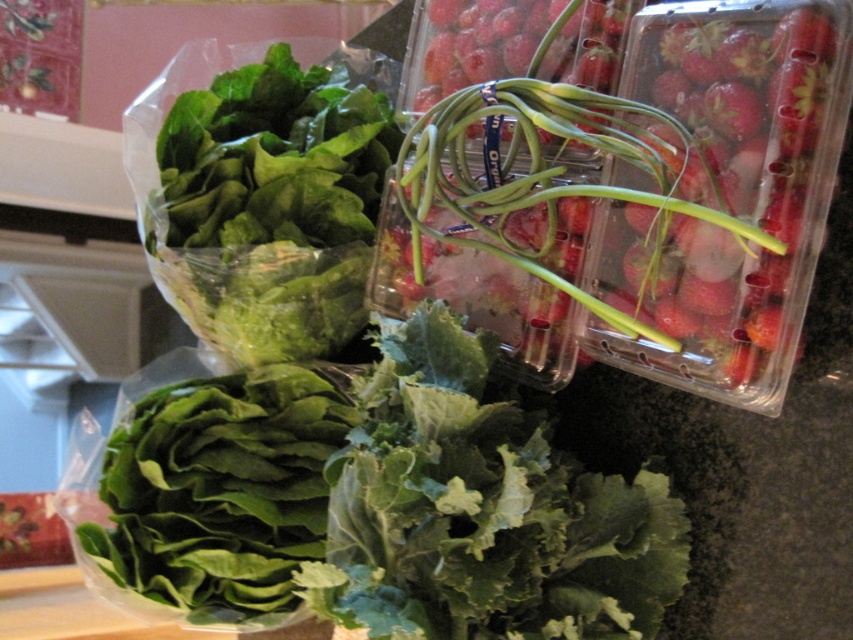
You are standing in front of the produce display. There are two points marked on the image. The first point is at coordinates point (451, 465) and the second is at point (294, 296). Which point is closer to you?

Point (451, 465) is closer to the viewer than point (294, 296).

You are organizing the produce section at a grocery store. You have two green leafy items on the counter. The green leafy at center and the green leafy lettuce at lower left. Which one should you place in the larger storage container?

The green leafy at center should be placed in the larger storage container because it has a larger size compared to the green leafy lettuce at lower left.

You are standing in front of the dark countertop with fresh produce. There is a green leafy at center at point (482, 512). Where is the green leafy at center located relative to the strawberries in the background?

The green leafy at center is located at point (482, 512), which is in the foreground relative to the strawberries in the background.